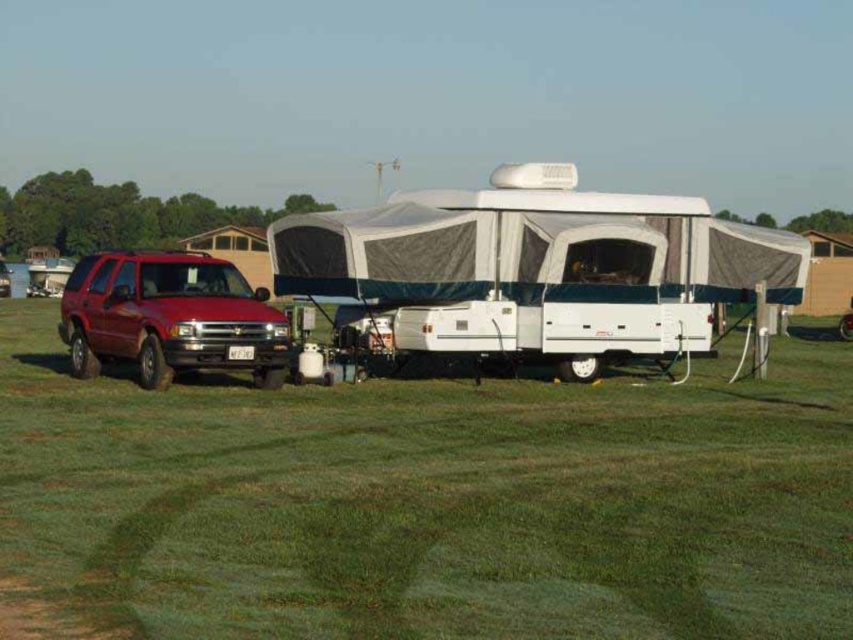
Question: Does green grassy field at center have a lesser width compared to white fabric tent at center?

Choices:
 (A) yes
 (B) no

Answer: (B)

Question: Is green grassy field at center above white fabric tent at center?

Choices:
 (A) no
 (B) yes

Answer: (A)

Question: Among these objects, which one is nearest to the camera?

Choices:
 (A) white fabric tent at center
 (B) green grassy field at center

Answer: (B)

Question: Which of the following is the farthest from the observer?

Choices:
 (A) (572, 262)
 (B) (155, 340)

Answer: (A)

Question: Which object is closer to the camera taking this photo?

Choices:
 (A) green grassy field at center
 (B) matte red suv at left
 (C) white fabric tent at center

Answer: (A)

Question: Can you confirm if white fabric tent at center is positioned to the right of matte red suv at left?

Choices:
 (A) yes
 (B) no

Answer: (A)